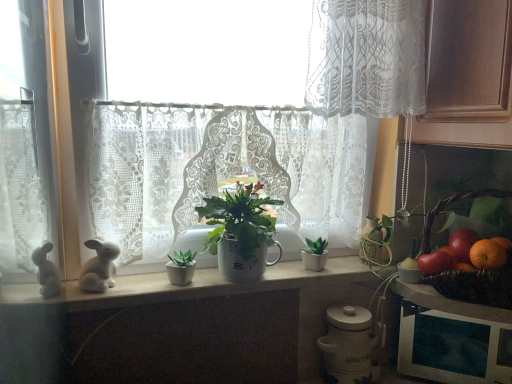
Question: From the image's perspective, is white ceramic mug at center positioned above or below white lace curtain at upper center, placed as the first curtain when sorted from top to bottom?

Choices:
 (A) above
 (B) below

Answer: (B)

Question: Considering the positions of point (245, 233) and point (339, 105), is point (245, 233) closer or farther from the camera than point (339, 105)?

Choices:
 (A) farther
 (B) closer

Answer: (A)

Question: Which of these objects is positioned farthest from the white ceramic mug at center?

Choices:
 (A) white lace curtain at upper center, the second curtain positioned from the left
 (B) shiny red tomato at right, which appears as the 2th fruit when viewed from the right
 (C) shiny red tomato at right, acting as the 1th fruit starting from the right
 (D) white glossy rabbit at left
 (E) white lace curtain at center, which appears as the 1th curtain when viewed from the left

Answer: (C)

Question: Based on their relative distances, which object is farther from the matte white flowerpot at center?

Choices:
 (A) shiny red tomato at right, positioned as the second fruit in left-to-right order
 (B) white glossy rabbit at left
 (C) white matte counter top at center
 (D) white lace curtain at center, which is the first curtain in bottom-to-top order
 (E) orange matte at right

Answer: (E)